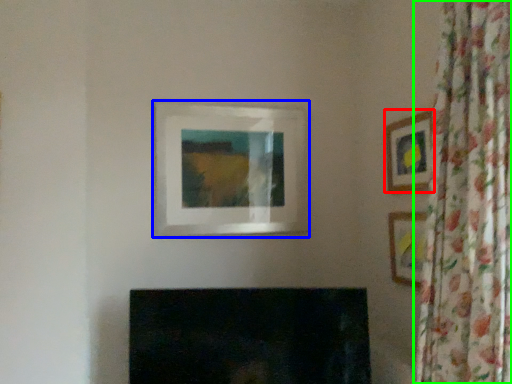
Question: Which object is positioned closest to picture frame (highlighted by a red box)? Select from picture frame (highlighted by a blue box) and curtain (highlighted by a green box).

Choices:
 (A) picture frame
 (B) curtain

Answer: (B)